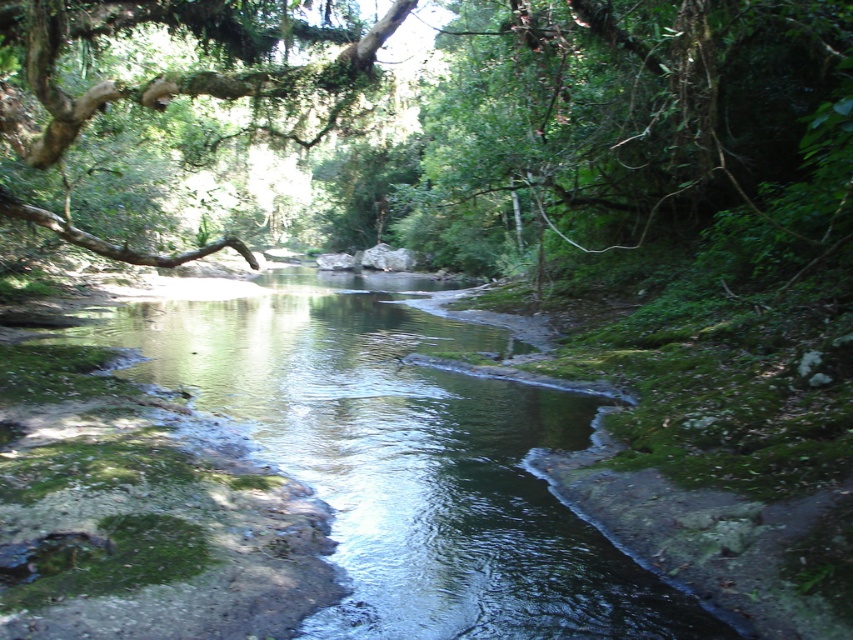
Question: Can you confirm if green mossy river at center is positioned below green mossy branch at upper left?

Choices:
 (A) no
 (B) yes

Answer: (B)

Question: Which of the following is the closest to the observer?

Choices:
 (A) (140, 259)
 (B) (680, 609)

Answer: (B)

Question: Can you confirm if green mossy river at center is wider than green mossy branch at upper left?

Choices:
 (A) yes
 (B) no

Answer: (A)

Question: Is green mossy river at center above green mossy branch at upper left?

Choices:
 (A) yes
 (B) no

Answer: (B)

Question: Which point is closer to the camera?

Choices:
 (A) (575, 515)
 (B) (375, 51)

Answer: (A)